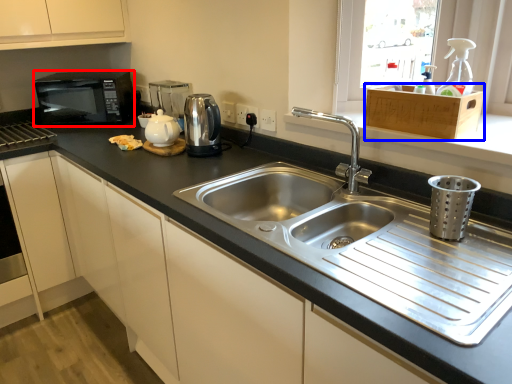
Question: Which object is closer to the camera taking this photo, microwave oven (highlighted by a red box) or cabinetry (highlighted by a blue box)?

Choices:
 (A) microwave oven
 (B) cabinetry

Answer: (B)